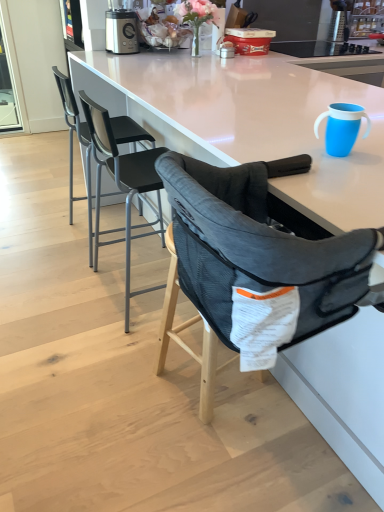
The image size is (384, 512). Find the location of `vacant space in front of black mesh chair at center, which is counted as the second chair, starting from the front`. vacant space in front of black mesh chair at center, which is counted as the second chair, starting from the front is located at coordinates (96, 351).